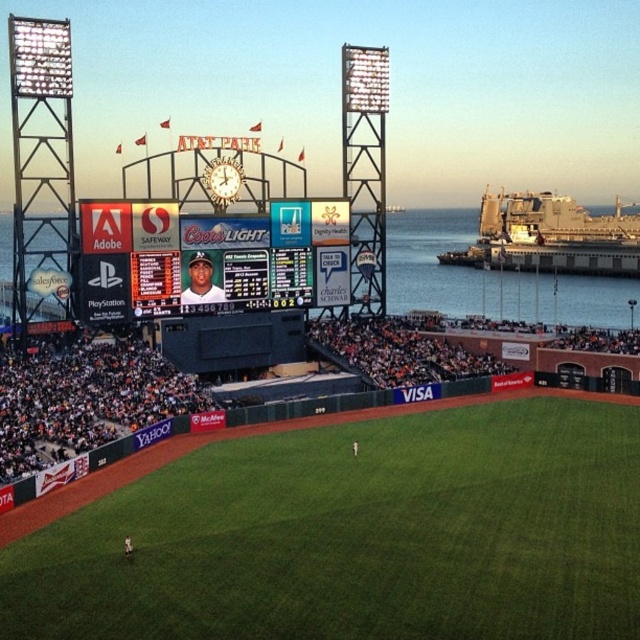
Who is more distant from viewer, (220, 269) or (593, 323)?

The point (593, 323) is behind.

Is matte black scoreboard at center thinner than transparent glass water at upper center?

Indeed, matte black scoreboard at center has a lesser width compared to transparent glass water at upper center.

You are a GUI agent. You are given a task and a screenshot of the screen. Output one action in this format:
    pyautogui.click(x=<x>, y=<y>)
    Task: Click on the matte black scoreboard at center
    The height and width of the screenshot is (640, 640).
    Given the screenshot: What is the action you would take?
    pyautogui.click(x=211, y=259)

Where is `matte black scoreboard at center`? Image resolution: width=640 pixels, height=640 pixels. matte black scoreboard at center is located at coordinates (211, 259).